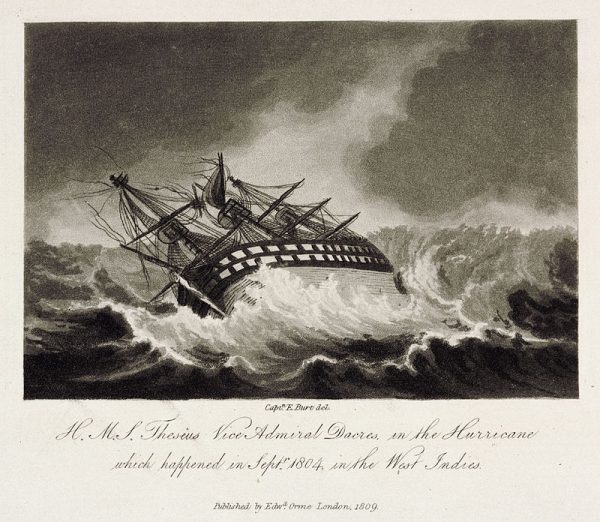
At what (x,y) coordinates should I click in order to perform the action: click on border of art work. Please return your answer as a coordinate pair (x, y). This screenshot has width=600, height=522. Looking at the image, I should click on (588, 199), (506, 494).